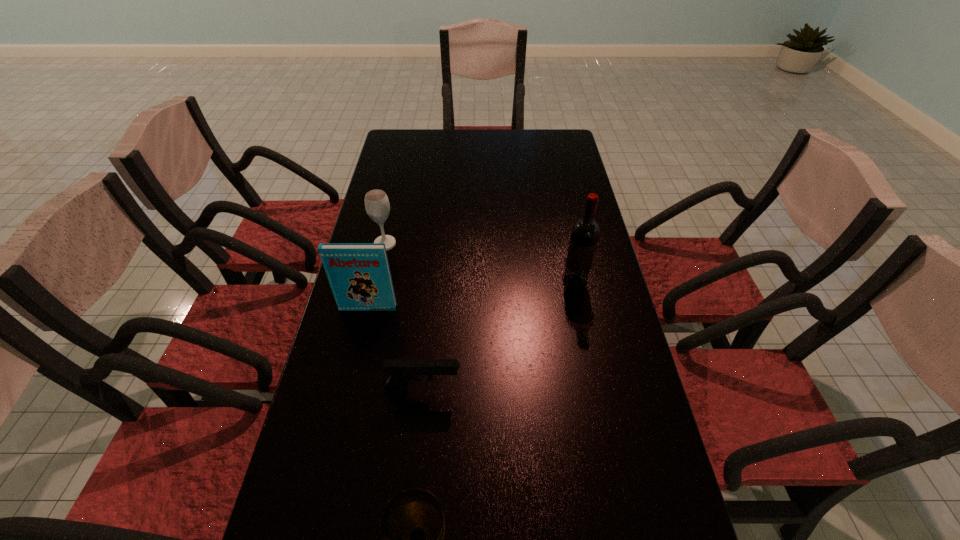
Where is `free space located 0.230m on the right of the third tallest object`? free space located 0.230m on the right of the third tallest object is located at coordinates 470,244.

Find the location of a particular element. The width and height of the screenshot is (960, 540). free space located on the front-facing side of the second nearest object is located at coordinates (487, 389).

The width and height of the screenshot is (960, 540). I want to click on book located in the left edge section of the desktop, so click(x=359, y=274).

Image resolution: width=960 pixels, height=540 pixels. What are the coordinates of `wineglass positioned at the left edge` in the screenshot? It's located at (377, 205).

Where is `pistol present at the left edge`? pistol present at the left edge is located at coordinates (402, 371).

In order to click on object present at the right edge in this screenshot , I will do `click(585, 232)`.

Where is `vacant space at the far edge of the desktop`? This screenshot has height=540, width=960. vacant space at the far edge of the desktop is located at coordinates (x=512, y=157).

At what (x,y) coordinates should I click in order to perform the action: click on vacant space at the left edge. Please return your answer as a coordinate pair (x, y). This screenshot has height=540, width=960. Looking at the image, I should click on (392, 335).

The width and height of the screenshot is (960, 540). In order to click on vacant space at the right edge of the desktop in this screenshot , I will do `click(612, 291)`.

At what (x,y) coordinates should I click in order to perform the action: click on free space at the far left corner. Please return your answer as a coordinate pair (x, y). This screenshot has height=540, width=960. Looking at the image, I should click on (426, 139).